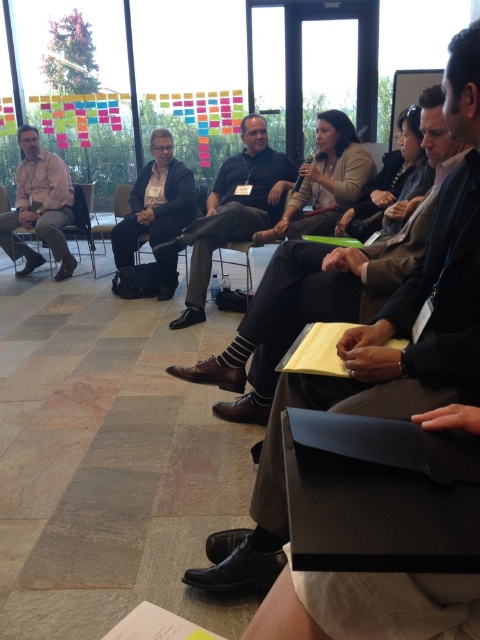
You are organizing a photo shoot in the conference room and need to ensure that the two participants in the dark gray suit at center and the matte black suit at center are framed properly. Given that the camera has a fixed focal length, which participant should be positioned closer to the camera to maintain their relative sizes as seen in the original image?

A: The dark gray suit at center should be positioned closer to the camera because its width is greater than the matte black suit at center, so moving it closer will help maintain the original size difference between them.

You are attending a meeting in the conference room and need to determine who is standing closer to the front of the room. You see the dark brown leather shoes at center and the matte pink shirt at left. Which one is closer to the front?

The dark brown leather shoes at center are closer to the front of the room because they have a lesser height compared to the matte pink shirt at left, indicating they are positioned lower in the image which corresponds to being nearer the front.

You are attending a conference and want to approach the speaker who is wearing the matte black suit at center. There is a matte pink shirt at left blocking your path. Can you walk directly to the speaker without going around?

The matte black suit at center is in front of the matte pink shirt at left, so the path is clear. You can walk directly to the speaker wearing the matte black suit at center without needing to go around the person in the matte pink shirt at left.